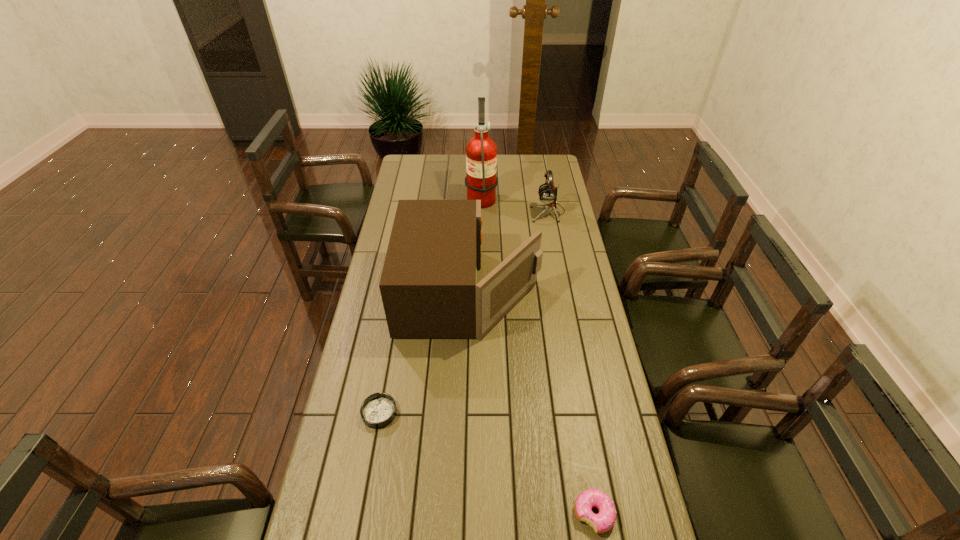
Identify the location of free region at the left edge. This screenshot has height=540, width=960. (418, 195).

In the image, there is a desktop. Find the location of `vacant space at the right edge`. vacant space at the right edge is located at coordinates (555, 222).

The image size is (960, 540). I want to click on vacant space at the far right corner of the desktop, so click(x=558, y=164).

Find the location of `vacant space that is in between the doughnut and the microwave oven`. vacant space that is in between the doughnut and the microwave oven is located at coordinates (532, 403).

Locate an element on the screen. The image size is (960, 540). blank region between the nearest object and the microwave oven is located at coordinates (532, 403).

Where is `vacant area that lies between the tallest object and the nearest object`? Image resolution: width=960 pixels, height=540 pixels. vacant area that lies between the tallest object and the nearest object is located at coordinates (538, 355).

I want to click on vacant space in between the fire extinguisher and the earphone, so click(x=515, y=204).

The height and width of the screenshot is (540, 960). Identify the location of vacant space that's between the ashtray and the third nearest object. 424,353.

The width and height of the screenshot is (960, 540). Identify the location of free spot between the second shortest object and the third tallest object. (571, 363).

Find the location of a particular element. The height and width of the screenshot is (540, 960). free point between the tallest object and the second shortest object is located at coordinates (538, 355).